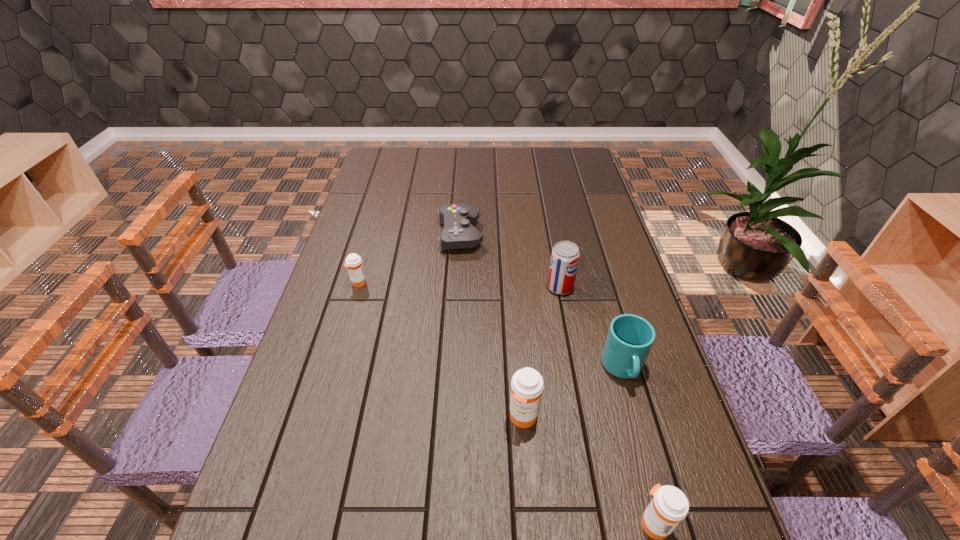
Where is `vacant space that is in between the fifth tallest object and the third object from right to left`? The height and width of the screenshot is (540, 960). vacant space that is in between the fifth tallest object and the third object from right to left is located at coordinates (459, 285).

The width and height of the screenshot is (960, 540). What are the coordinates of `free spot between the fourth object from left to right and the second medicine from right to left` in the screenshot? It's located at (541, 352).

Where is `free point between the farthest object and the soda`? The height and width of the screenshot is (540, 960). free point between the farthest object and the soda is located at coordinates pos(510,261).

The image size is (960, 540). Find the location of `vacant area between the fourth object from left to right and the second farthest medicine`. vacant area between the fourth object from left to right and the second farthest medicine is located at coordinates (541, 352).

This screenshot has height=540, width=960. In order to click on object that can be found as the third closest to the soda in this screenshot , I will do `click(527, 384)`.

You are a GUI agent. You are given a task and a screenshot of the screen. Output one action in this format:
    pyautogui.click(x=<x>, y=<y>)
    Task: Click on the object that is the second closest to the shortest object
    The width and height of the screenshot is (960, 540).
    Given the screenshot: What is the action you would take?
    pyautogui.click(x=353, y=261)

Identify which medicine is the third nearest to the fourth farthest object. Please provide its 2D coordinates. Your answer should be formatted as a tuple, i.e. [(x, y)], where the tuple contains the x and y coordinates of a point satisfying the conditions above.

[(353, 261)]

Locate an element on the screen. the closest medicine to the cup is located at coordinates (527, 384).

The image size is (960, 540). Identify the location of free space that satisfies the following two spatial constraints: 1. on the front side of the shortest object; 2. on the right side of the tallest medicine. (450, 417).

What are the coordinates of `free location that satisfies the following two spatial constraints: 1. on the back side of the second shortest object; 2. on the right side of the farthest object` in the screenshot? It's located at (372, 235).